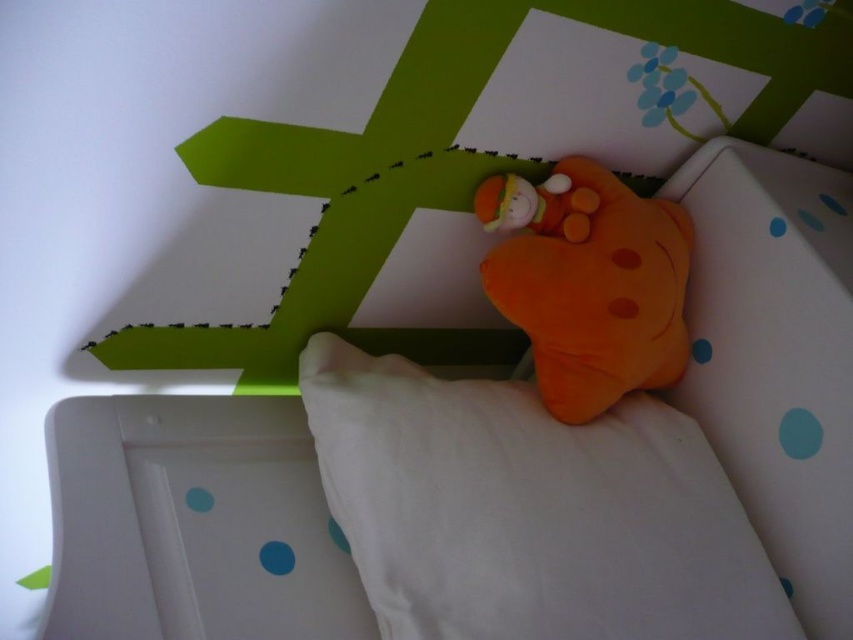
Which is more to the left, white soft pillow at upper center or orange plush toy at upper center?

white soft pillow at upper center is more to the left.

Can you confirm if white soft pillow at upper center is wider than orange plush toy at upper center?

Indeed, white soft pillow at upper center has a greater width compared to orange plush toy at upper center.

The height and width of the screenshot is (640, 853). What are the coordinates of `white soft pillow at upper center` in the screenshot? It's located at tap(531, 509).

In order to click on white soft pillow at upper center in this screenshot , I will do `click(531, 509)`.

Who is lower down, orange plush toy at upper center or fluffy orange plush at upper center?

orange plush toy at upper center

Can you confirm if orange plush toy at upper center is positioned below fluffy orange plush at upper center?

Correct, orange plush toy at upper center is located below fluffy orange plush at upper center.

The image size is (853, 640). Describe the element at coordinates (589, 282) in the screenshot. I see `orange plush toy at upper center` at that location.

At what (x,y) coordinates should I click in order to perform the action: click on orange plush toy at upper center. Please return your answer as a coordinate pair (x, y). This screenshot has width=853, height=640. Looking at the image, I should click on (589, 282).

Who is shorter, white soft pillow at upper center or fluffy orange plush at upper center?

fluffy orange plush at upper center is shorter.

Can you confirm if white soft pillow at upper center is shorter than fluffy orange plush at upper center?

In fact, white soft pillow at upper center may be taller than fluffy orange plush at upper center.

Does point (722, 572) come behind point (553, 209)?

That is False.

The width and height of the screenshot is (853, 640). I want to click on white soft pillow at upper center, so click(531, 509).